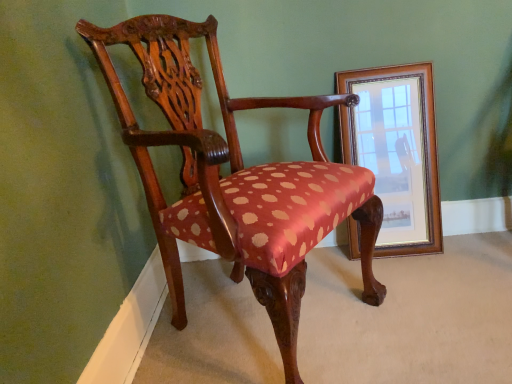
Describe the element at coordinates (396, 152) in the screenshot. This screenshot has height=384, width=512. I see `wooden framed mirror at right` at that location.

This screenshot has width=512, height=384. Identify the location of wooden framed mirror at right. (396, 152).

Where is `polished wood chair at center`? polished wood chair at center is located at coordinates (231, 175).

Measure the distance between polished wood chair at center and camera.

The depth of polished wood chair at center is 33.88 inches.

This screenshot has width=512, height=384. Describe the element at coordinates (231, 175) in the screenshot. I see `polished wood chair at center` at that location.

This screenshot has width=512, height=384. Find the location of `wooden framed mirror at right`. wooden framed mirror at right is located at coordinates (396, 152).

In the scene shown: Is polished wood chair at center to the left or to the right of wooden framed mirror at right in the image?

polished wood chair at center is to the left of wooden framed mirror at right.

Consider the image. Considering their positions, is polished wood chair at center located in front of or behind wooden framed mirror at right?

polished wood chair at center is positioned closer to the viewer than wooden framed mirror at right.

Between point (122, 89) and point (394, 72), which one is positioned in front?

The point (122, 89) is closer to the camera.

From the image's perspective, is polished wood chair at center over wooden framed mirror at right?

No, from the image's perspective, polished wood chair at center is not above wooden framed mirror at right.

From a real-world perspective, is polished wood chair at center positioned above or below wooden framed mirror at right?

polished wood chair at center is situated higher than wooden framed mirror at right in the real world.

Can you confirm if polished wood chair at center is thinner than wooden framed mirror at right?

Incorrect, the width of polished wood chair at center is not less than that of wooden framed mirror at right.

Considering the relative sizes of polished wood chair at center and wooden framed mirror at right in the image provided, is polished wood chair at center shorter than wooden framed mirror at right?

No, polished wood chair at center is not shorter than wooden framed mirror at right.

Does polished wood chair at center have a larger size compared to wooden framed mirror at right?

Correct, polished wood chair at center is larger in size than wooden framed mirror at right.

Is wooden framed mirror at right located within polished wood chair at center?

No, wooden framed mirror at right is not inside polished wood chair at center.

Is polished wood chair at center not near wooden framed mirror at right?

No, polished wood chair at center is not far from wooden framed mirror at right.

Is polished wood chair at center looking in the opposite direction of wooden framed mirror at right?

polished wood chair at center does not have its back to wooden framed mirror at right.

This screenshot has height=384, width=512. In order to click on picture frame that is above the polished wood chair at center (from the image's perspective) in this screenshot , I will do `click(396, 152)`.

In the scene shown: Does wooden framed mirror at right appear on the right side of polished wood chair at center?

Correct, you'll find wooden framed mirror at right to the right of polished wood chair at center.

Is the position of wooden framed mirror at right more distant than that of polished wood chair at center?

Yes, wooden framed mirror at right is further from the viewer.

Which is behind, point (373, 83) or point (112, 64)?

Positioned behind is point (373, 83).

From the image's perspective, which object appears higher, wooden framed mirror at right or polished wood chair at center?

wooden framed mirror at right, from the image's perspective.

From a real-world perspective, which is physically below, wooden framed mirror at right or polished wood chair at center?

In real-world perspective, wooden framed mirror at right is lower.

Considering the sizes of objects wooden framed mirror at right and polished wood chair at center in the image provided, who is thinner, wooden framed mirror at right or polished wood chair at center?

wooden framed mirror at right.

Consider the image. Considering the relative sizes of wooden framed mirror at right and polished wood chair at center in the image provided, is wooden framed mirror at right taller than polished wood chair at center?

Incorrect, the height of wooden framed mirror at right is not larger of that of polished wood chair at center.

Between wooden framed mirror at right and polished wood chair at center, which one has larger size?

polished wood chair at center is bigger.

Do you think wooden framed mirror at right is within polished wood chair at center, or outside of it?

wooden framed mirror at right is located beyond the bounds of polished wood chair at center.

Are wooden framed mirror at right and polished wood chair at center making contact?

wooden framed mirror at right and polished wood chair at center are clearly separated.

Could you tell me if wooden framed mirror at right is facing polished wood chair at center?

No, wooden framed mirror at right is not facing towards polished wood chair at center.

How many degrees apart are the facing directions of wooden framed mirror at right and polished wood chair at center?

57.6 degrees separate the facing orientations of wooden framed mirror at right and polished wood chair at center.

Locate an element on the screen. chair above the wooden framed mirror at right (from a real-world perspective) is located at coordinates (231, 175).

Find the location of a particular element. This screenshot has width=512, height=384. picture frame that is behind the polished wood chair at center is located at coordinates (396, 152).

Locate an element on the screen. The height and width of the screenshot is (384, 512). picture frame above the polished wood chair at center (from the image's perspective) is located at coordinates (396, 152).